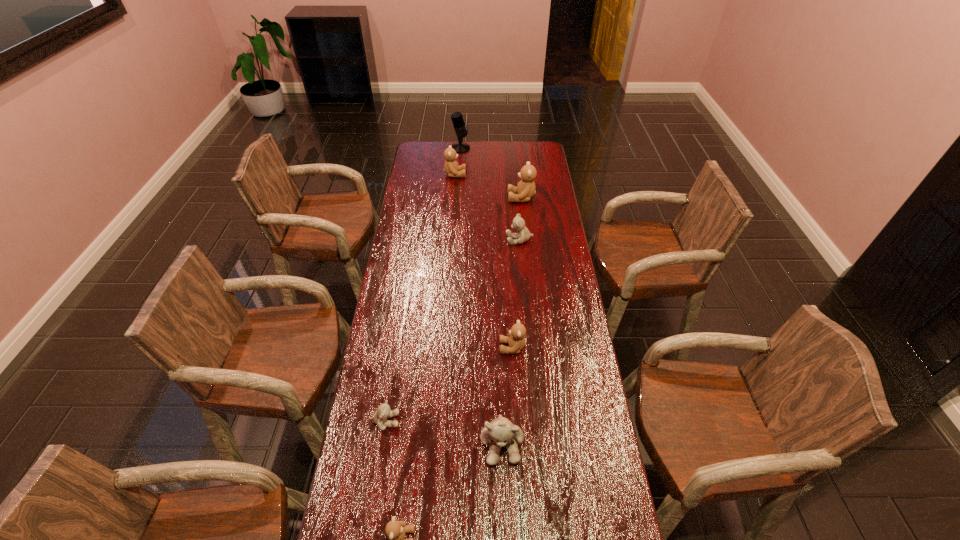
At what (x,y) coordinates should I click in order to perform the action: click on the second closest teddy bear to the fourth nearest object. Please return your answer as a coordinate pair (x, y). This screenshot has height=540, width=960. Looking at the image, I should click on (383, 412).

Where is `the closest teddy bear to the farthest teddy bear`? This screenshot has height=540, width=960. the closest teddy bear to the farthest teddy bear is located at coordinates (525, 189).

Find the location of a particular element. This screenshot has height=540, width=960. brown teddy bear object that ranks as the third closest to the second nearest brown teddy bear is located at coordinates (451, 167).

Identify which brown teddy bear is the closest to the fifth farthest object. Please provide its 2D coordinates. Your answer should be formatted as a tuple, i.e. [(x, y)], where the tuple contains the x and y coordinates of a point satisfying the conditions above.

[(395, 530)]

Locate which gray teddy bear is the second closest to the fifth farthest object. Please provide its 2D coordinates. Your answer should be formatted as a tuple, i.e. [(x, y)], where the tuple contains the x and y coordinates of a point satisfying the conditions above.

[(383, 412)]

Identify the location of gray teddy bear that is the third nearest to the fifth farthest object. Image resolution: width=960 pixels, height=540 pixels. coord(523,235).

Find the location of a particular element. Image resolution: width=960 pixels, height=540 pixels. free spot that satisfies the following two spatial constraints: 1. on the front-facing side of the third nearest brown teddy bear; 2. on the face of the biggest gray teddy bear is located at coordinates [x=548, y=443].

Locate an element on the screen. The width and height of the screenshot is (960, 540). vacant area in the image that satisfies the following two spatial constraints: 1. on the front-facing side of the fourth farthest teddy bear; 2. on the face of the biggest gray teddy bear is located at coordinates (518, 443).